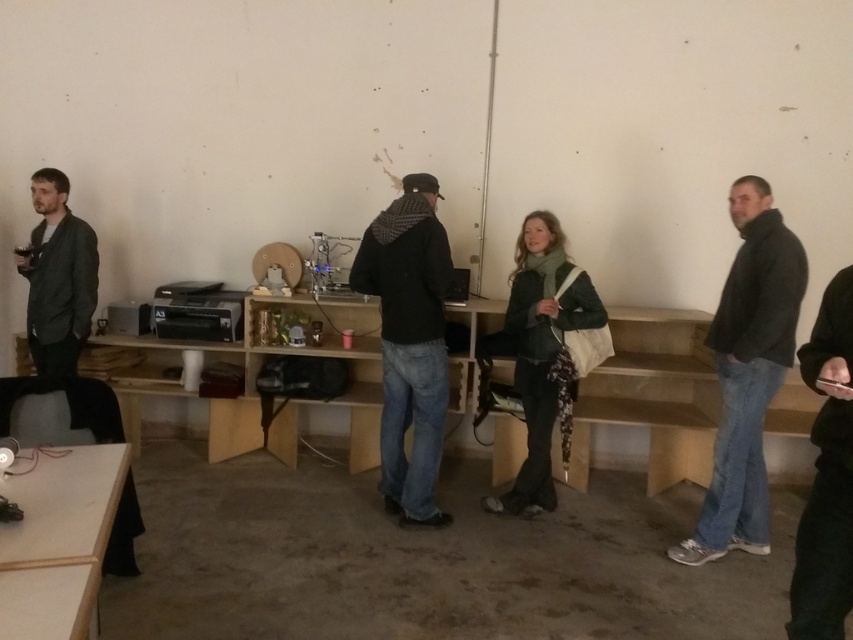
Question: Does green wool scarf at center lie behind matte black jacket at left?

Choices:
 (A) no
 (B) yes

Answer: (A)

Question: Among these objects, which one is nearest to the camera?

Choices:
 (A) black matte jacket at center
 (B) dark gray jacket at center

Answer: (B)

Question: Which object appears closest to the camera in this image?

Choices:
 (A) green wool scarf at center
 (B) black fabric phone at lower right

Answer: (B)

Question: Which point is farther from the camera taking this photo?

Choices:
 (A) (83, 328)
 (B) (740, 250)

Answer: (A)

Question: Can you confirm if green wool scarf at center is positioned to the left of matte black jacket at left?

Choices:
 (A) yes
 (B) no

Answer: (B)

Question: Is dark gray jacket at center positioned behind light brown wooden table at lower left?

Choices:
 (A) yes
 (B) no

Answer: (A)